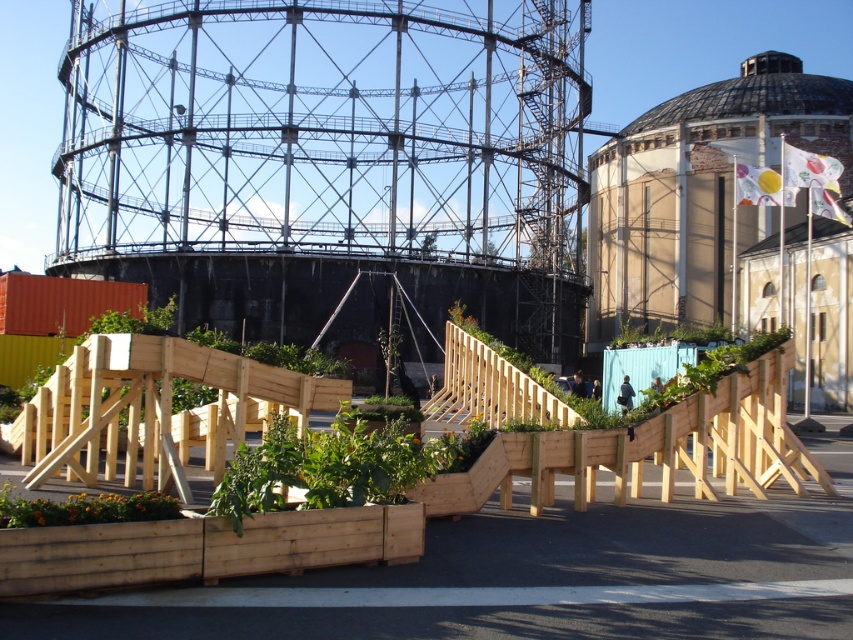
Consider the image. You are standing at the base of the flagpole between the two points mentioned. Which point, point (x=384, y=464) or point (x=117, y=506), is closer to you?

Point (x=384, y=464) is further to the viewer than point (x=117, y=506), so the closer point to you is point (x=117, y=506).

You are a city planner reviewing the urban landscape image. You need to determine the vertical arrangement of the green wooden planter at center and the wooden planter at lower left. Which planter is positioned higher in the scene?

The green wooden planter at center is positioned higher than the wooden planter at lower left.

You are standing at the point marked as point (x=294, y=440) in the urban landscape. A new streetlight needs to be installed exactly 50 meters away from your current position. Is the distance between you and the gas holder structure sufficient to place the streetlight at that distance?

The distance between you and point (x=294, y=440) is 40.74 meters. Since the required distance for the streetlight is 50 meters, the current distance is insufficient. You would need to move further away to reach the required 50 meters.